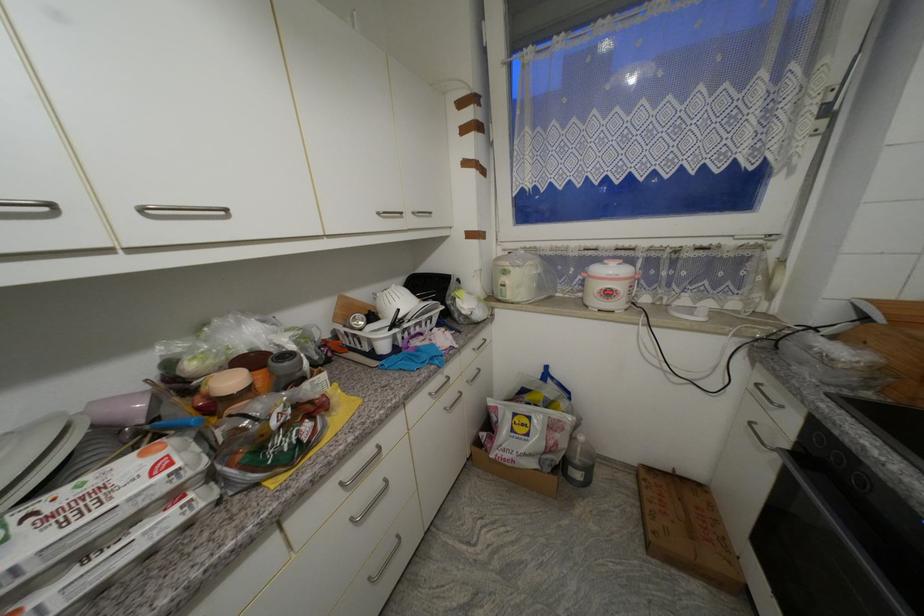
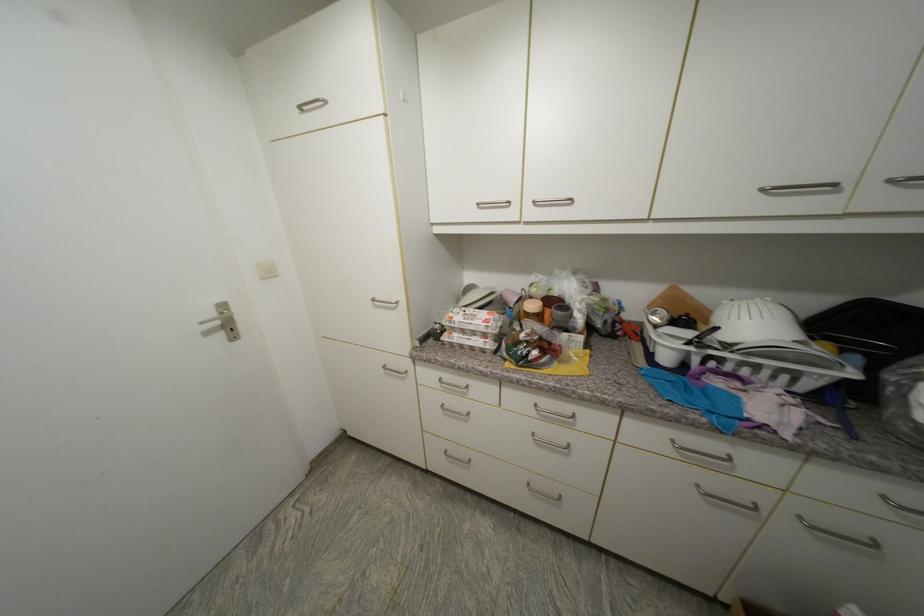
Where in the second image is the point corresponding to (405,312) from the first image?

(723, 330)